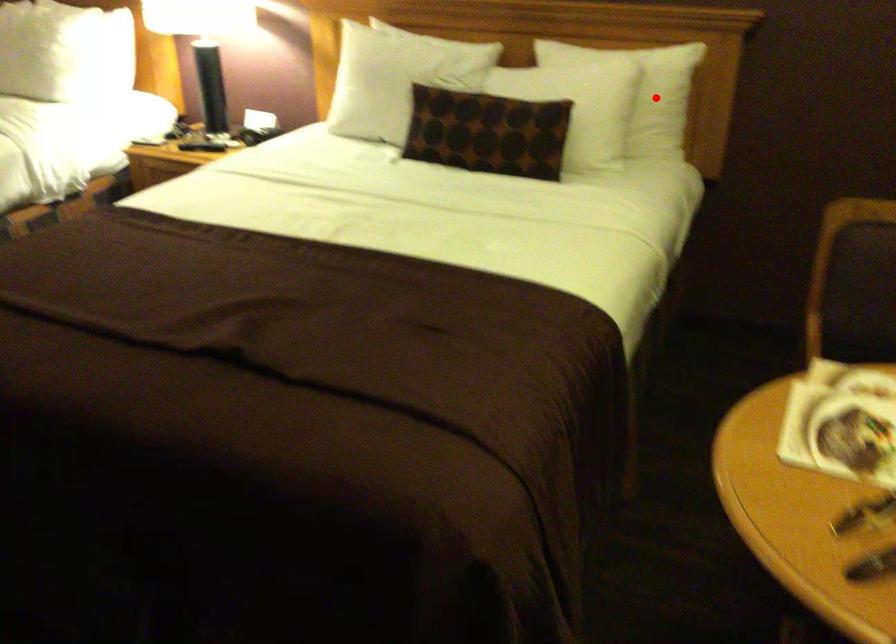
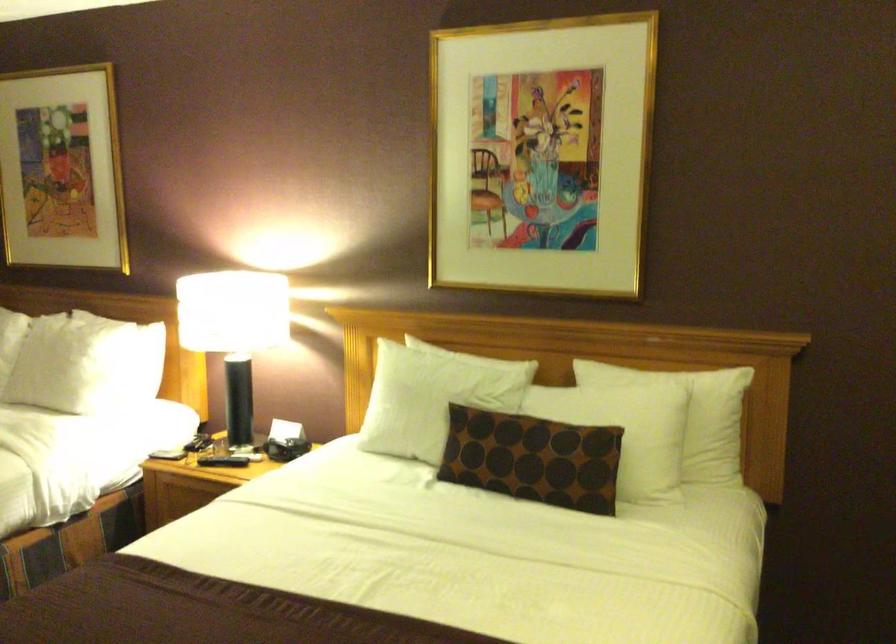
Where in the second image is the point corresponding to the highlighted location from the first image?

(709, 422)